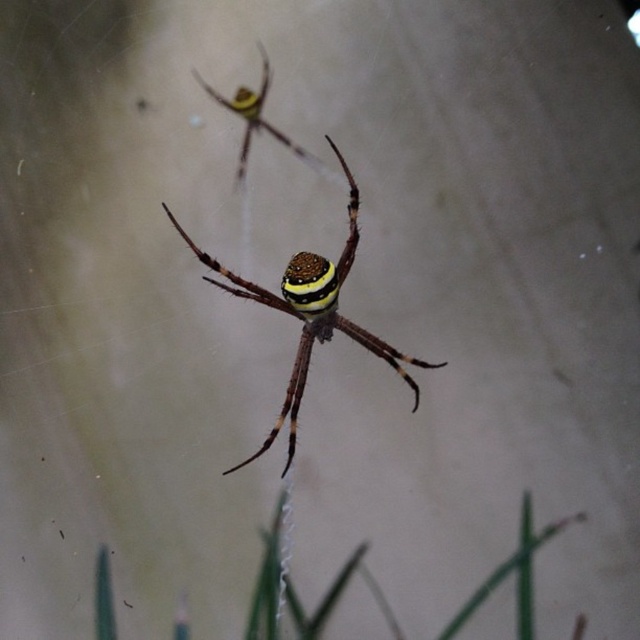
Is yellow striped spider at center thinner than yellow striped spider at upper center?

Incorrect, yellow striped spider at center's width is not less than yellow striped spider at upper center's.

Which is more to the left, yellow striped spider at center or yellow striped spider at upper center?

Positioned to the left is yellow striped spider at upper center.

Is point (292, 387) positioned in front of point (198, 84)?

That is True.

The width and height of the screenshot is (640, 640). Find the location of `yellow striped spider at center`. yellow striped spider at center is located at coordinates (308, 314).

Is green grass at bottom further to camera compared to yellow striped spider at upper center?

No, green grass at bottom is closer to the viewer.

Which is above, green grass at bottom or yellow striped spider at upper center?

Positioned higher is yellow striped spider at upper center.

At what (x,y) coordinates should I click in order to perform the action: click on green grass at bottom. Please return your answer as a coordinate pair (x, y). This screenshot has height=640, width=640. Looking at the image, I should click on (512, 572).

Identify the location of green grass at bottom. (512, 572).

Who is more distant from viewer, (525, 552) or (408, 360)?

Point (525, 552)

Who is more forward, [579,515] or [298,362]?

Point [298,362]

Identify the location of green grass at bottom. The image size is (640, 640). (512, 572).